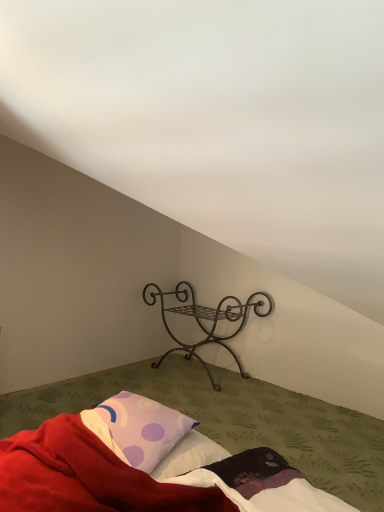
Question: From a real-world perspective, is dark brown wrought iron stand at center beneath purple dotted pillow at lower left?

Choices:
 (A) no
 (B) yes

Answer: (B)

Question: Does dark brown wrought iron stand at center come in front of purple dotted pillow at lower left?

Choices:
 (A) yes
 (B) no

Answer: (B)

Question: Is the position of dark brown wrought iron stand at center more distant than that of purple dotted pillow at lower left?

Choices:
 (A) yes
 (B) no

Answer: (A)

Question: Considering the relative positions of dark brown wrought iron stand at center and purple dotted pillow at lower left in the image provided, is dark brown wrought iron stand at center to the right of purple dotted pillow at lower left from the viewer's perspective?

Choices:
 (A) yes
 (B) no

Answer: (A)

Question: Can you confirm if dark brown wrought iron stand at center is taller than purple dotted pillow at lower left?

Choices:
 (A) yes
 (B) no

Answer: (A)

Question: Is dark brown wrought iron stand at center next to purple dotted pillow at lower left and touching it?

Choices:
 (A) no
 (B) yes

Answer: (A)

Question: Is purple dotted pillow at lower left in front of soft cotton bed at center?

Choices:
 (A) yes
 (B) no

Answer: (B)

Question: Can you confirm if purple dotted pillow at lower left is wider than soft cotton bed at center?

Choices:
 (A) no
 (B) yes

Answer: (A)

Question: From the image's perspective, is purple dotted pillow at lower left on soft cotton bed at center?

Choices:
 (A) yes
 (B) no

Answer: (A)

Question: Is purple dotted pillow at lower left positioned with its back to soft cotton bed at center?

Choices:
 (A) yes
 (B) no

Answer: (A)

Question: Does purple dotted pillow at lower left have a lesser width compared to soft cotton bed at center?

Choices:
 (A) no
 (B) yes

Answer: (B)

Question: Is the depth of purple dotted pillow at lower left greater than that of soft cotton bed at center?

Choices:
 (A) yes
 (B) no

Answer: (A)

Question: From the image's perspective, does purple dotted pillow at lower left appear lower than dark brown wrought iron stand at center?

Choices:
 (A) no
 (B) yes

Answer: (B)